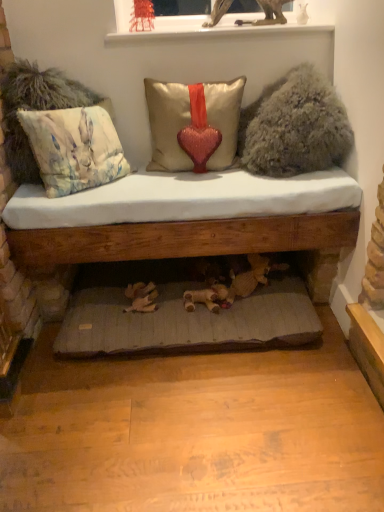
Find the location of a particular element. free space above wooden bed frame at lower center (from a real-world perspective) is located at coordinates (180, 288).